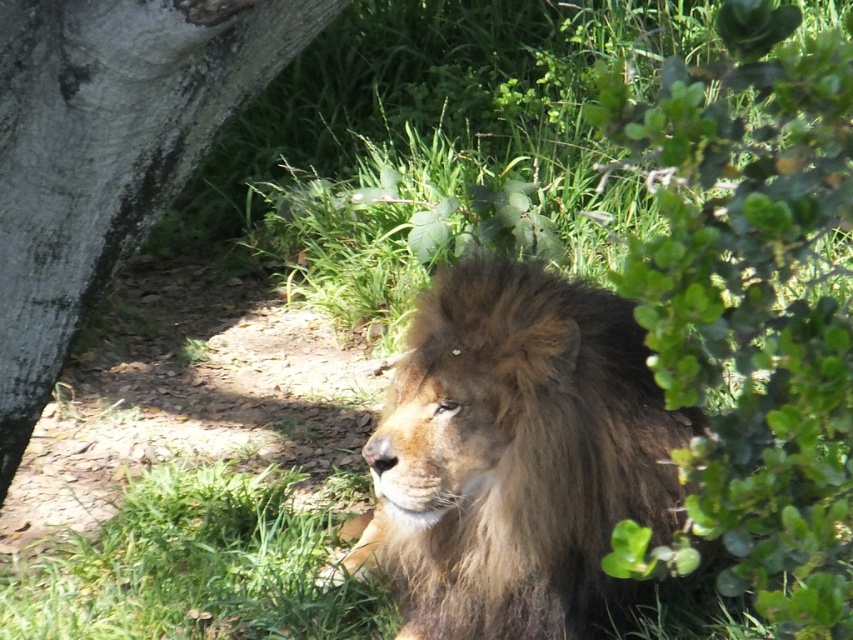
Question: Which of the following is the farthest from the observer?

Choices:
 (A) (495, 612)
 (B) (798, 618)

Answer: (A)

Question: In this image, where is brown furry lion at center located relative to gray rough bark tree at left?

Choices:
 (A) above
 (B) below

Answer: (B)

Question: Is green leafy bush at right wider than brown furry lion at center?

Choices:
 (A) yes
 (B) no

Answer: (B)

Question: Can you confirm if brown furry lion at center is thinner than gray rough bark tree at left?

Choices:
 (A) yes
 (B) no

Answer: (B)

Question: Which object is the closest to the brown furry lion at center?

Choices:
 (A) gray rough bark tree at left
 (B) green leafy bush at right

Answer: (A)

Question: Among these points, which one is farthest from the camera?

Choices:
 (A) (672, 364)
 (B) (529, 616)
 (C) (1, 305)

Answer: (B)